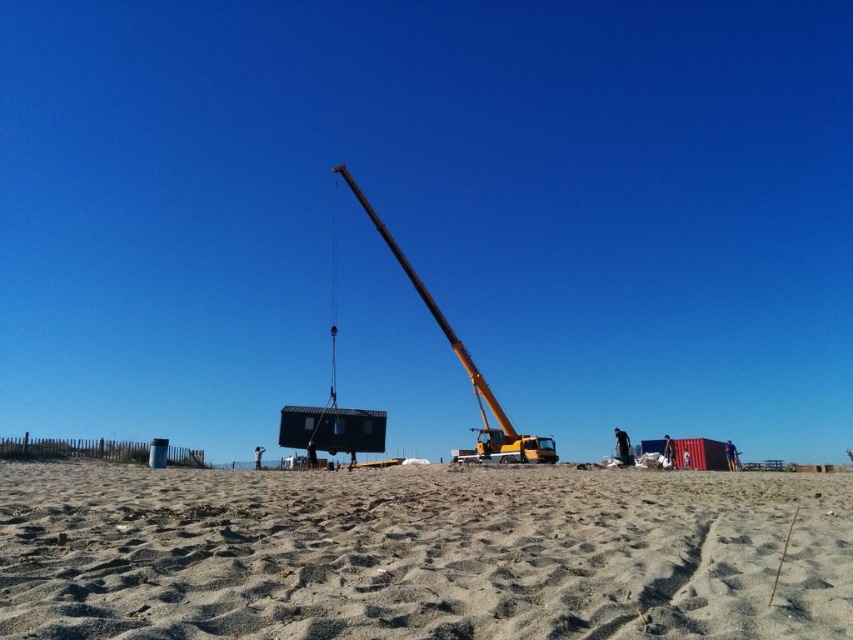
Question: Does sandy beach at lower center appear on the left side of yellow metallic crane at center?

Choices:
 (A) yes
 (B) no

Answer: (B)

Question: Can you confirm if sandy beach at lower center is positioned below yellow metallic crane at center?

Choices:
 (A) no
 (B) yes

Answer: (B)

Question: Can you confirm if sandy beach at lower center is thinner than yellow metallic crane at center?

Choices:
 (A) yes
 (B) no

Answer: (B)